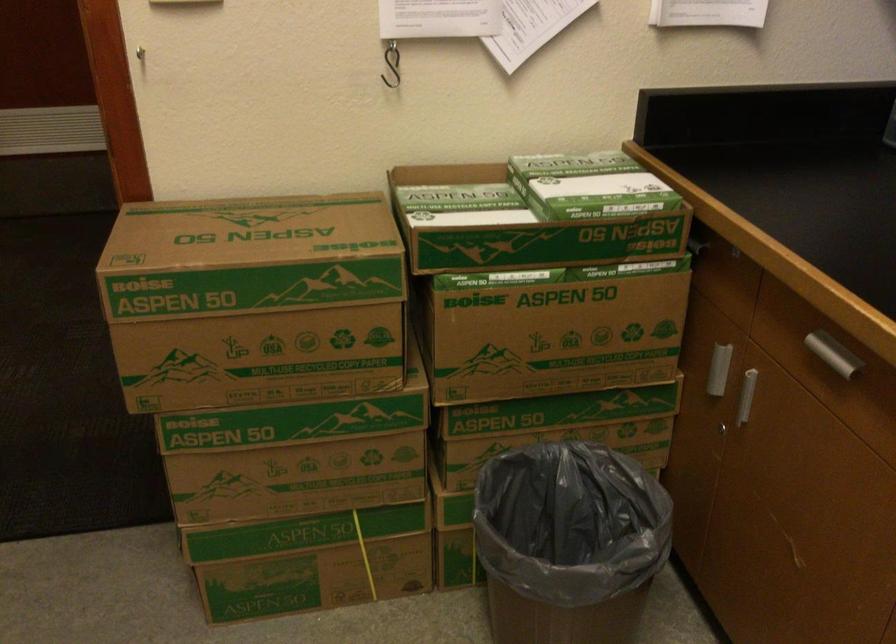
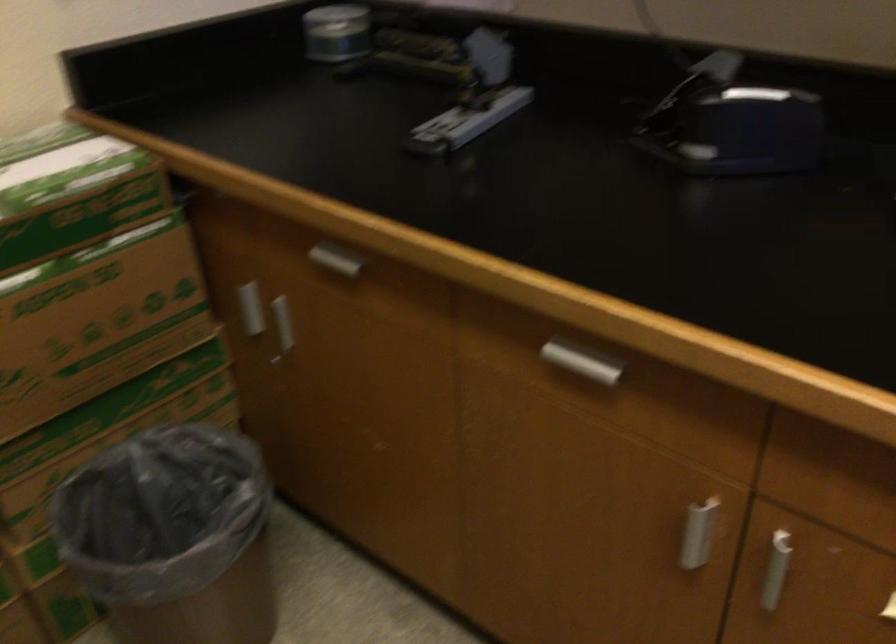
Locate, in the second image, the point that corresponds to point (513, 462) in the first image.

(91, 474)